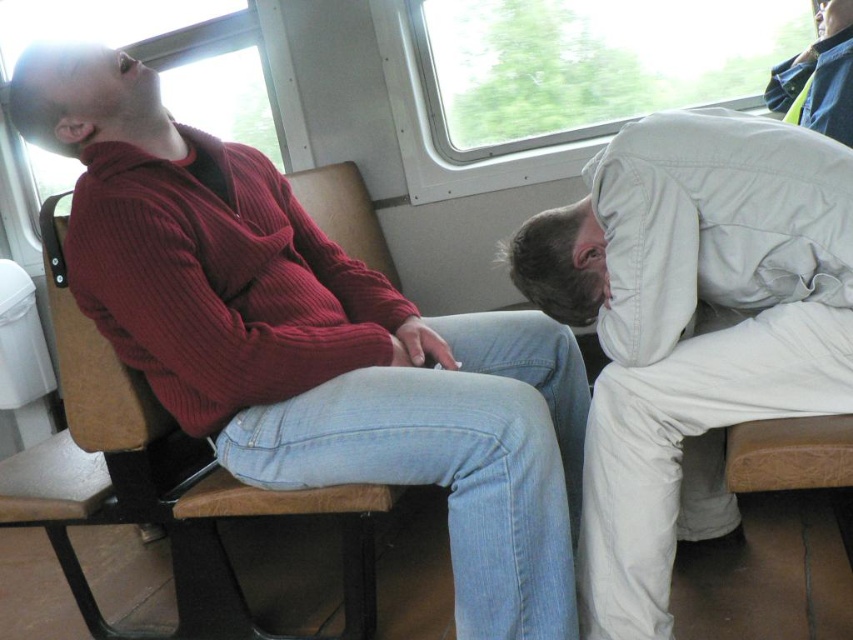
You are a tailor who needs to determine which item requires more fabric to make between the ribbed sweater at center and the light beige cotton pants at right. Which one would you choose?

The ribbed sweater at center has a larger size compared to light beige cotton pants at right, so it would require more fabric to make.

Looking at this image, you are a passenger sitting in the train compartment. You notice the ribbed sweater at center and the light beige cotton pants at right. Which object is positioned higher in the image?

The ribbed sweater at center is located above light beige cotton pants at right, so it is positioned higher in the image.

You are a passenger sitting in the train compartment described. You notice two points marked in the scene. Which of the two points, point [134,234] or point [785,264], is nearer to you?

Point [134,234] is closer to the camera than point [785,264], so the point [134,234] is nearer to you.